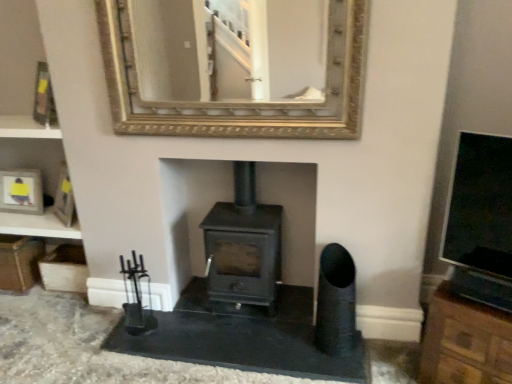
Locate an element on the screen. The width and height of the screenshot is (512, 384). blank area to the left of black matte wood burning stove at center is located at coordinates (186, 317).